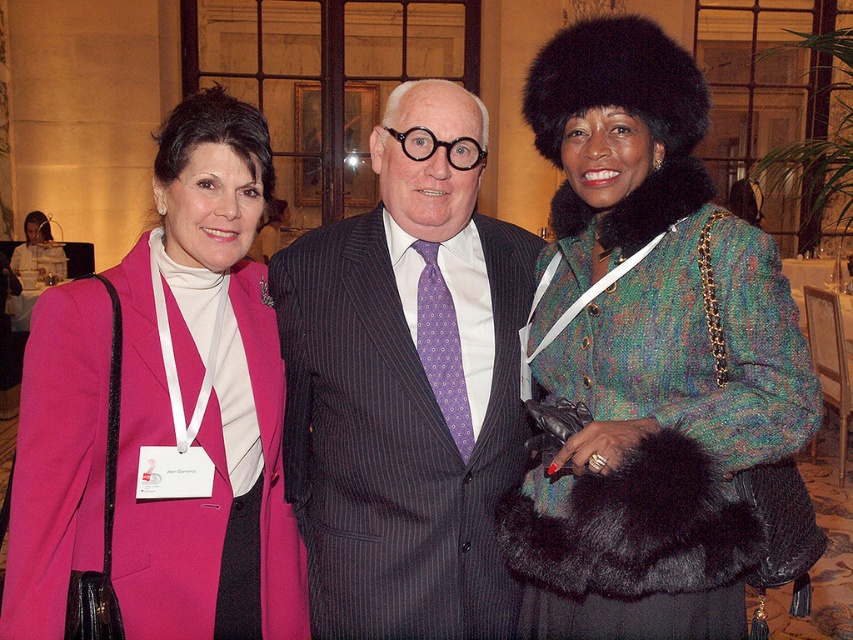
Can you confirm if multicolored tweed coat at center is wider than purple pinstriped suit at center?

No, multicolored tweed coat at center is not wider than purple pinstriped suit at center.

Is point (566, 141) closer to camera compared to point (463, 376)?

Yes, point (566, 141) is closer to viewer.

The width and height of the screenshot is (853, 640). In order to click on multicolored tweed coat at center in this screenshot , I will do `click(646, 353)`.

Identify the location of multicolored tweed coat at center. This screenshot has height=640, width=853. (646, 353).

Is point (751, 324) closer to camera compared to point (148, 413)?

Yes, it is.

Which is below, multicolored tweed coat at center or matte pink coat at center?

matte pink coat at center is below.

Where is `multicolored tweed coat at center`? The height and width of the screenshot is (640, 853). multicolored tweed coat at center is located at coordinates (646, 353).

In the scene shown: Can you confirm if matte pink coat at center is positioned below purple pinstriped suit at center?

Yes.

Can you confirm if matte pink coat at center is thinner than purple pinstriped suit at center?

Correct, matte pink coat at center's width is less than purple pinstriped suit at center's.

Between point (57, 541) and point (395, 490), which one is positioned in front?

Point (57, 541) is more forward.

Identify the location of matte pink coat at center. (164, 413).